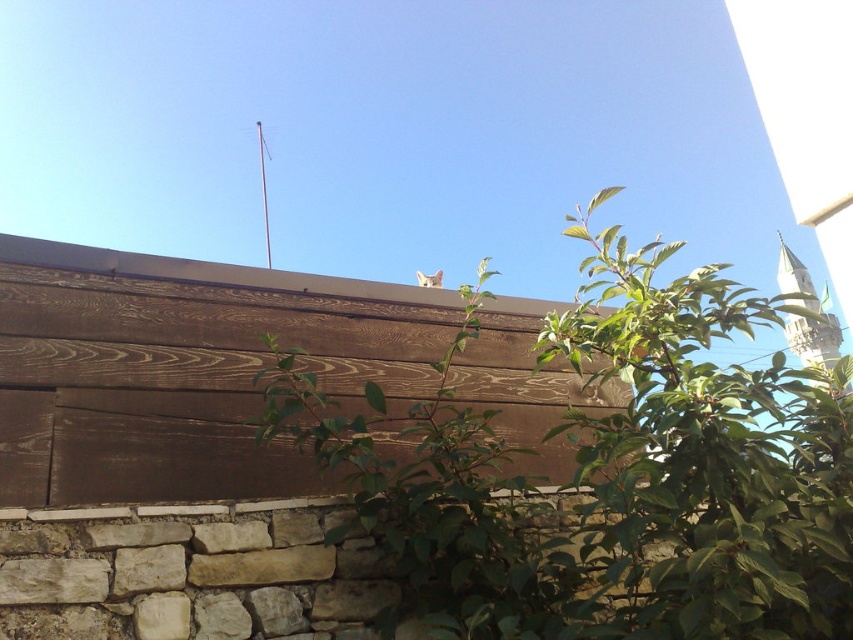
Based on the photo, is green leafy plant at upper center wider than brown wood plank at upper center?

Indeed, green leafy plant at upper center has a greater width compared to brown wood plank at upper center.

Who is higher up, green leafy plant at upper center or brown wood plank at upper center?

green leafy plant at upper center is above.

Does point (804, 394) come farther from viewer compared to point (148, 332)?

No, (804, 394) is closer to viewer.

This screenshot has height=640, width=853. Identify the location of green leafy plant at upper center. (611, 476).